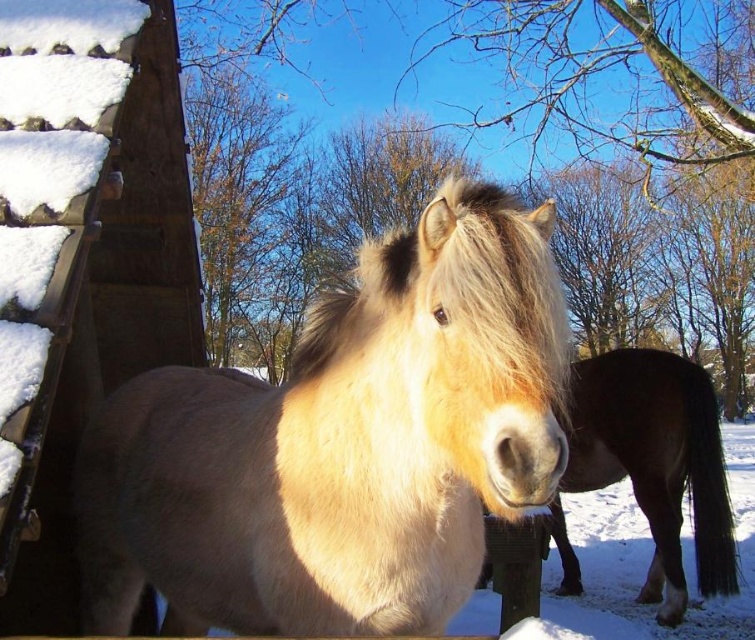
Question: Observing the image, what is the correct spatial positioning of light brown fur horse at center in reference to brown fuzzy horse at center?

Choices:
 (A) above
 (B) below

Answer: (A)

Question: Which object appears closest to the camera in this image?

Choices:
 (A) light brown fur horse at center
 (B) brown fuzzy horse at center

Answer: (A)

Question: Which point is farther from the camera taking this photo?

Choices:
 (A) (729, 576)
 (B) (370, 369)

Answer: (A)

Question: Among these objects, which one is farthest from the camera?

Choices:
 (A) light brown fur horse at center
 (B) brown fuzzy horse at center

Answer: (B)

Question: Does light brown fur horse at center have a larger size compared to brown fuzzy horse at center?

Choices:
 (A) no
 (B) yes

Answer: (A)

Question: Can you confirm if light brown fur horse at center is positioned above brown fuzzy horse at center?

Choices:
 (A) no
 (B) yes

Answer: (B)